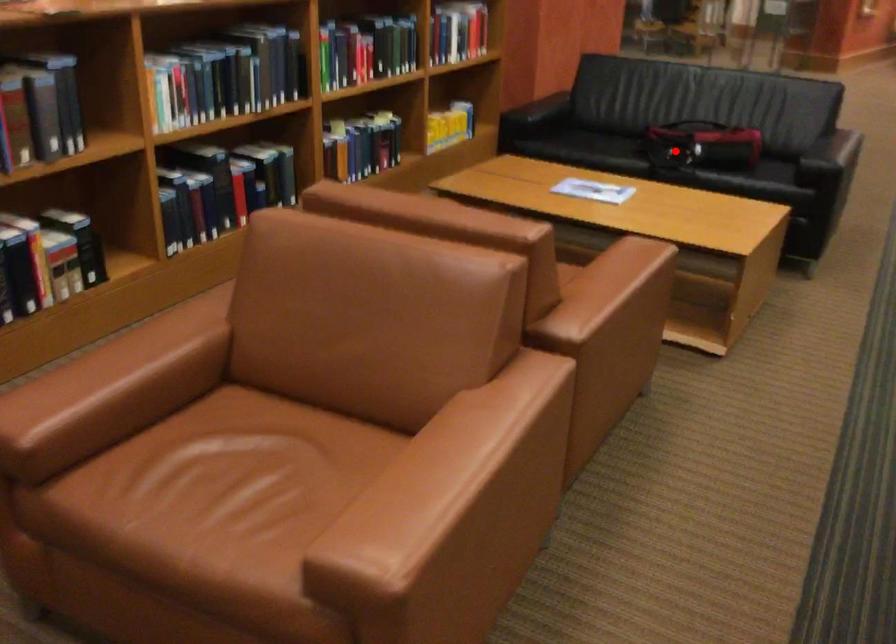
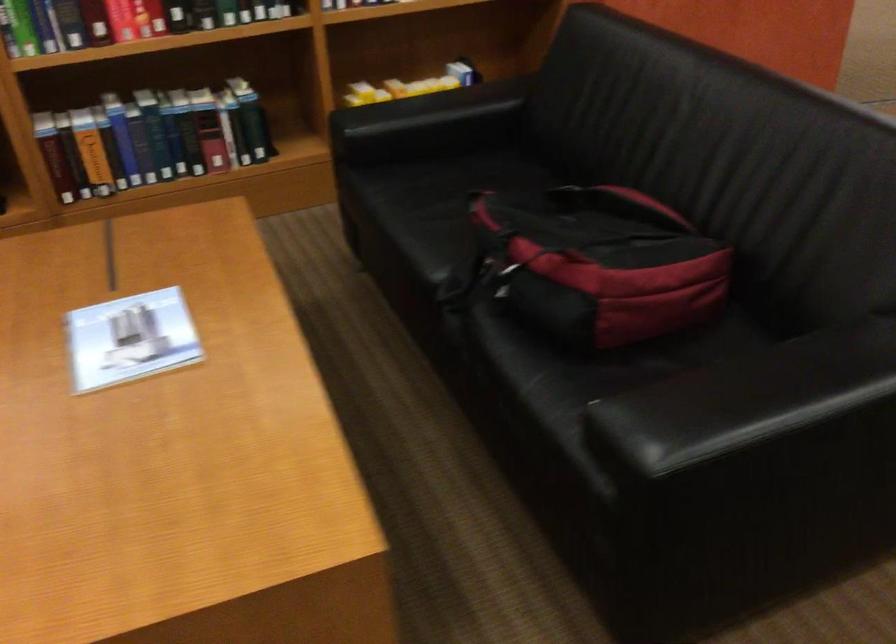
Question: I am providing you with two images of the same scene from different viewpoints. A red point is shown in image1. For the corresponding object point in image2, is it positioned nearer or farther from the camera?

Choices:
 (A) Nearer
 (B) Farther

Answer: (A)